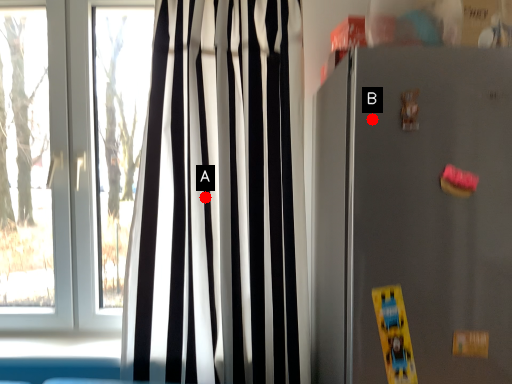
Question: Two points are circled on the image, labeled by A and B beside each circle. Which point is closer to the camera?

Choices:
 (A) A is closer
 (B) B is closer

Answer: (B)